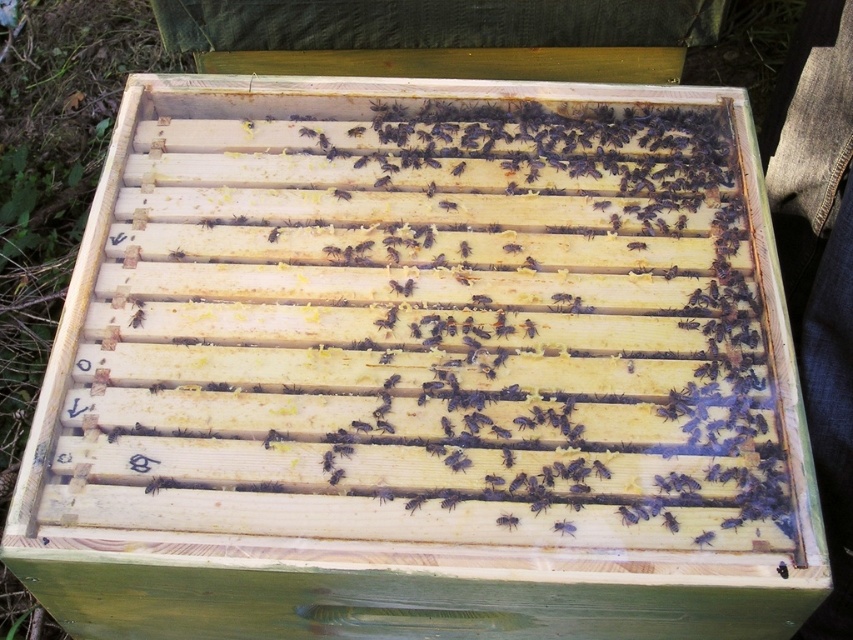
Who is higher up, black matte bee at center or black fuzzy bee at center?

black matte bee at center is above.

Is black matte bee at center above black fuzzy bee at center?

Indeed, black matte bee at center is positioned over black fuzzy bee at center.

Is point (497, 524) positioned behind point (570, 528)?

Yes, point (497, 524) is farther from viewer.

What are the coordinates of `black matte bee at center` in the screenshot? It's located at (508, 520).